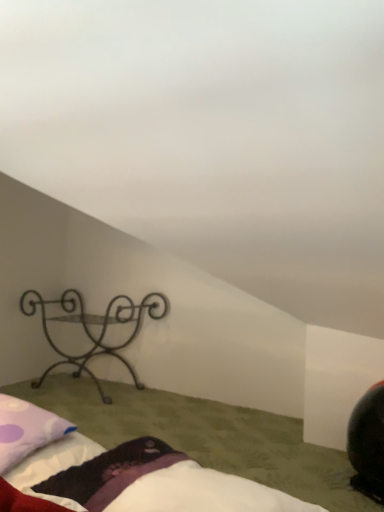
Question: Would you say fluffy white bed at lower center is to the left or to the right of purple dotted pillow at lower left in the picture?

Choices:
 (A) left
 (B) right

Answer: (B)

Question: From the image's perspective, is fluffy white bed at lower center positioned above or below purple dotted pillow at lower left?

Choices:
 (A) below
 (B) above

Answer: (A)

Question: Estimate the real-world distances between objects in this image. Which object is closer to the black wrought iron shelf at left?

Choices:
 (A) purple dotted pillow at lower left
 (B) fluffy white bed at lower center

Answer: (A)

Question: Considering the real-world distances, which object is closest to the purple dotted pillow at lower left?

Choices:
 (A) fluffy white bed at lower center
 (B) black wrought iron shelf at left

Answer: (A)